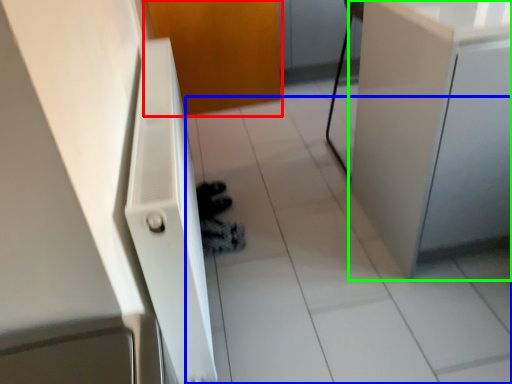
Question: Which is farther away from door (highlighted by a red box)? tile (highlighted by a blue box) or cabinetry (highlighted by a green box)?

Choices:
 (A) tile
 (B) cabinetry

Answer: (B)